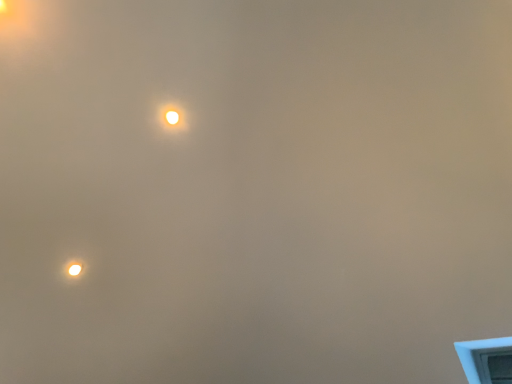
Locate an element on the screen. This screenshot has width=512, height=384. white glossy light at center is located at coordinates tap(172, 117).

This screenshot has height=384, width=512. Describe the element at coordinates (172, 117) in the screenshot. I see `white glossy light at center` at that location.

What are the coordinates of `white glossy light at center` in the screenshot? It's located at (172, 117).